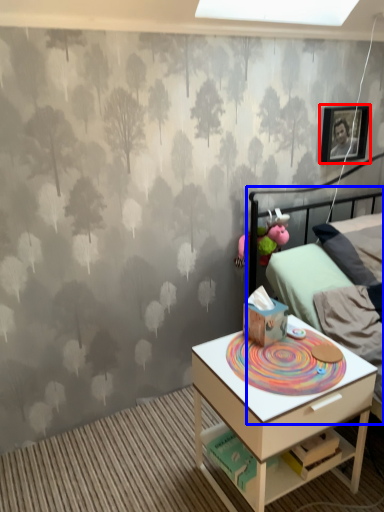
Question: Which of the following is the farthest to the observer, picture frame (highlighted by a red box) or bed (highlighted by a blue box)?

Choices:
 (A) picture frame
 (B) bed

Answer: (A)